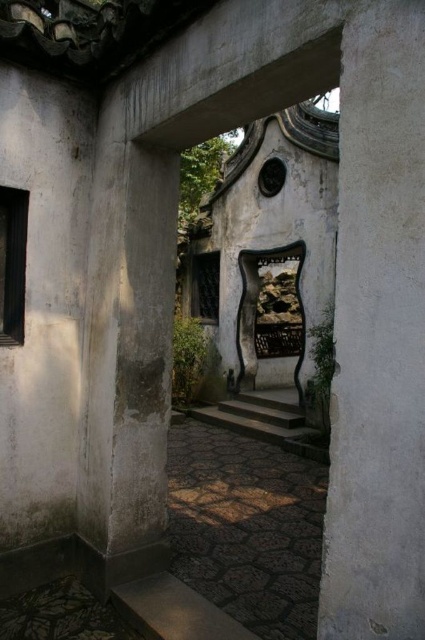
You are standing in the corridor of the traditional building and want to walk towards the decorative circular window. There are two points marked on the pathway ahead of you. Which point is closer to you, point (x=339, y=600) or point (x=235, y=410)?

Point (x=339, y=600) is closer to the viewer than point (x=235, y=410), so you should head towards that one first.

You are standing in the corridor and want to place a decorative item exactly at the center of the corridor. Given the white concrete pillar at right is at point 0.523, 0.889, where should you place the item to ensure it is centered?

To place the decorative item at the center of the corridor, you should position it at the midpoint between the white concrete pillar at right and the opposite wall. Since the pillar is at coordinates (377, 333), the center would be halfway between this point and the opposite wall, which would require measuring the distance from the pillar to the wall and dividing it by two.

You are an architect visiting this historical site and need to determine the relative sizes of the structures. Based on the scene, which object is smaller in size between the white concrete pillar at right and the dark gray stone stairs at center?

The white concrete pillar at right has a smaller size compared to the dark gray stone stairs at center, so the white concrete pillar at right is smaller.